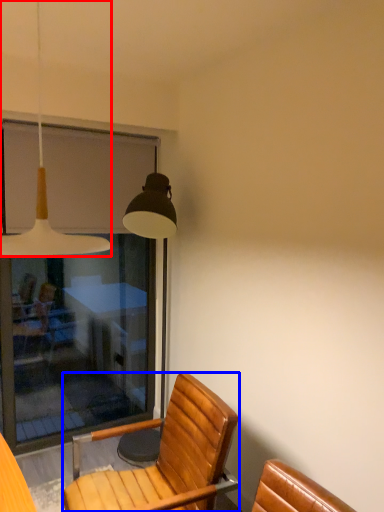
Question: Which point is closer to the camera, lamp (highlighted by a red box) or chair (highlighted by a blue box)?

Choices:
 (A) lamp
 (B) chair

Answer: (A)